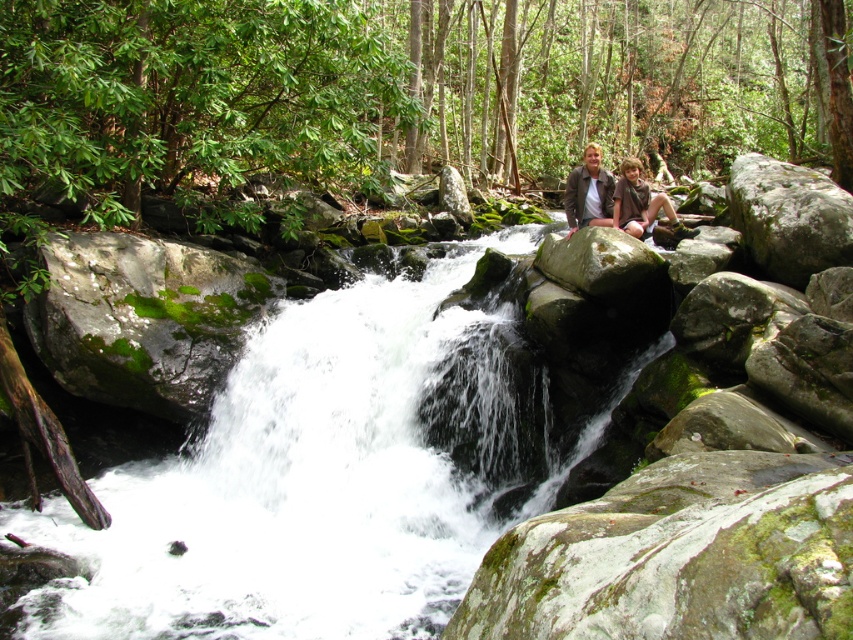
Question: Estimate the real-world distances between objects in this image. Which object is farther from the brown leather jacket at center?

Choices:
 (A) brown leather jacket at upper center
 (B) green mossy rock at center-right

Answer: (B)

Question: Is brown leather jacket at upper center behind brown leather jacket at center?

Choices:
 (A) no
 (B) yes

Answer: (A)

Question: Does white frothy water at center have a greater width compared to brown leather jacket at center?

Choices:
 (A) no
 (B) yes

Answer: (B)

Question: Based on their relative distances, which object is farther from the green mossy rock at center-right?

Choices:
 (A) green mossy rock at upper right
 (B) brown suede jacket at upper center
 (C) brown leather jacket at center
 (D) white frothy water at center

Answer: (B)

Question: Which object appears farthest from the camera in this image?

Choices:
 (A) green mossy rock at center-right
 (B) brown leather jacket at center
 (C) brown leather jacket at upper center
 (D) brown suede jacket at upper center

Answer: (D)

Question: Observing the image, what is the correct spatial positioning of white frothy water at center in reference to brown leather jacket at center?

Choices:
 (A) left
 (B) right

Answer: (A)